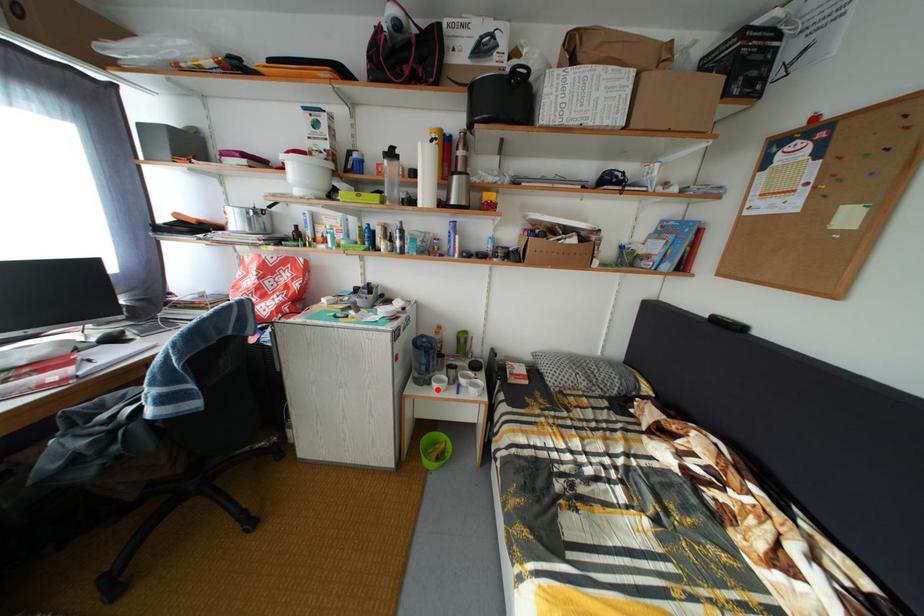
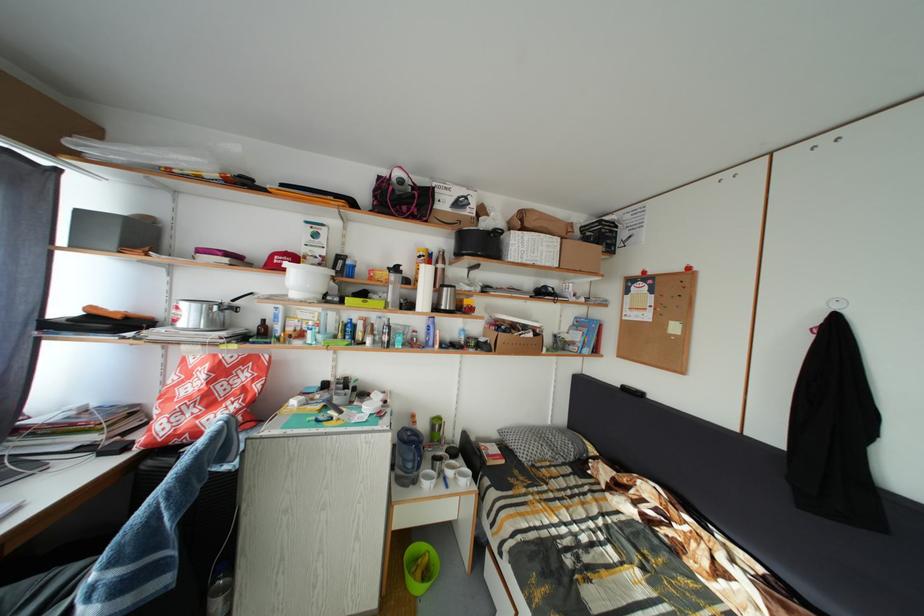
The point at the highlighted location is marked in the first image. Where is the corresponding point in the second image?

(423, 488)